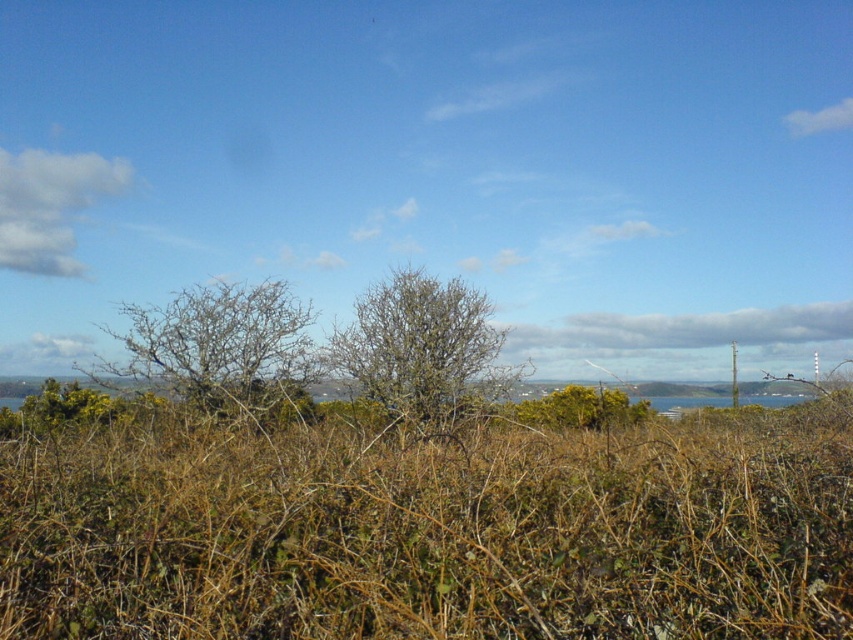
Question: Which object is positioned farthest from the bare branches at center?

Choices:
 (A) brown dry grass at center
 (B) green leafy bush at center
 (C) green leafy bush at lower left

Answer: (A)

Question: Which object is farther from the camera taking this photo?

Choices:
 (A) green leafy bush at center
 (B) bare branches at center
 (C) bare branches at left
 (D) green leafy bush at lower left

Answer: (A)

Question: In this image, where is bare branches at center located relative to green leafy bush at lower left?

Choices:
 (A) below
 (B) above

Answer: (B)

Question: Can you confirm if bare branches at left is wider than green leafy bush at lower left?

Choices:
 (A) no
 (B) yes

Answer: (B)

Question: Does brown dry grass at center appear on the left side of green leafy bush at center?

Choices:
 (A) yes
 (B) no

Answer: (A)

Question: Which object appears closest to the camera in this image?

Choices:
 (A) bare branches at left
 (B) brown dry grass at center

Answer: (B)